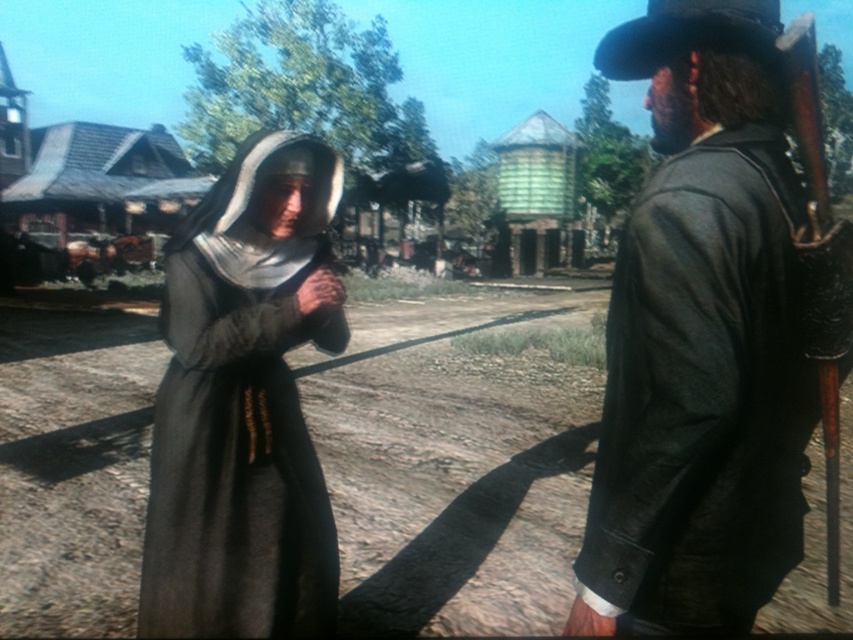
You are standing in the Western frontier town scene. You notice two points marked in the image. Which point is closer to you, point 1 at coordinates point (276, 513) or point 2 at coordinates point (628, 74)?

Point 1 at coordinates point (276, 513) is closer to you because it is further to the viewer than point 2 at coordinates point (628, 74).

You are a photographer positioned in front of the Western town scene. You want to take a photo that includes both the leather jacket at right and the gray woolen robe at center. Which object will appear larger in your photo?

The leather jacket at right will appear larger in the photo because it is closer to the viewer than the gray woolen robe at center.